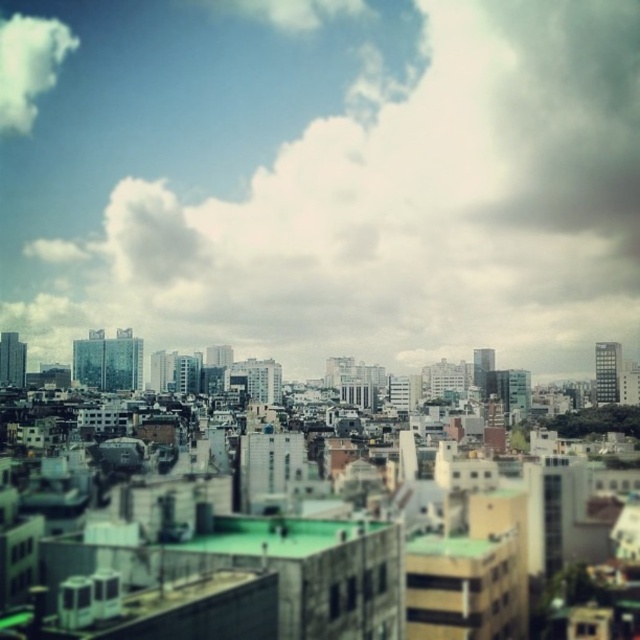
Is white fluffy cloud at upper center positioned in front of white fluffy cloud at upper left?

Yes, it is in front of white fluffy cloud at upper left.

Find the location of a particular element. The image size is (640, 640). white fluffy cloud at upper center is located at coordinates (332, 180).

Which is behind, point (609, 65) or point (16, 93)?

Positioned behind is point (16, 93).

You are a GUI agent. You are given a task and a screenshot of the screen. Output one action in this format:
    pyautogui.click(x=<x>, y=<y>)
    Task: Click on the white fluffy cloud at upper center
    
    Given the screenshot: What is the action you would take?
    332,180